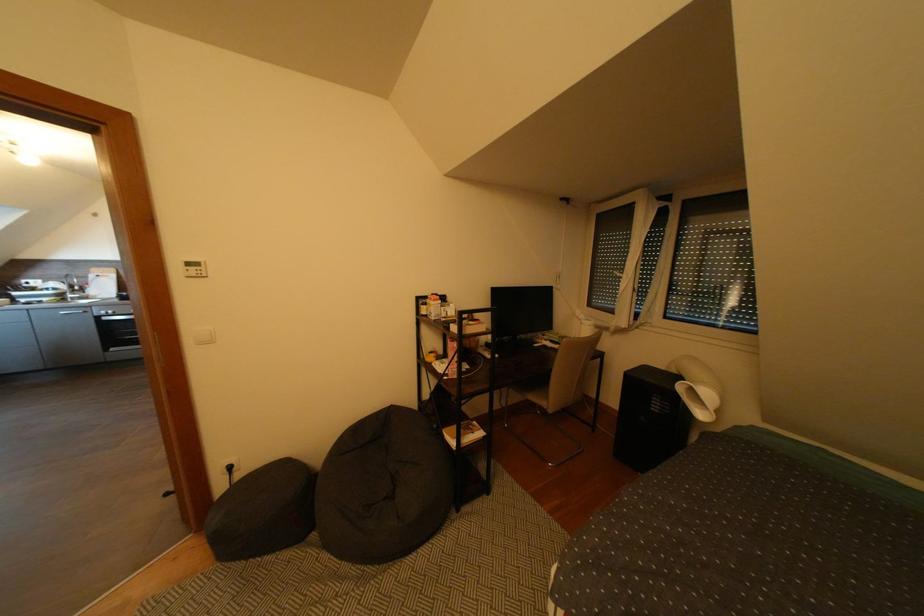
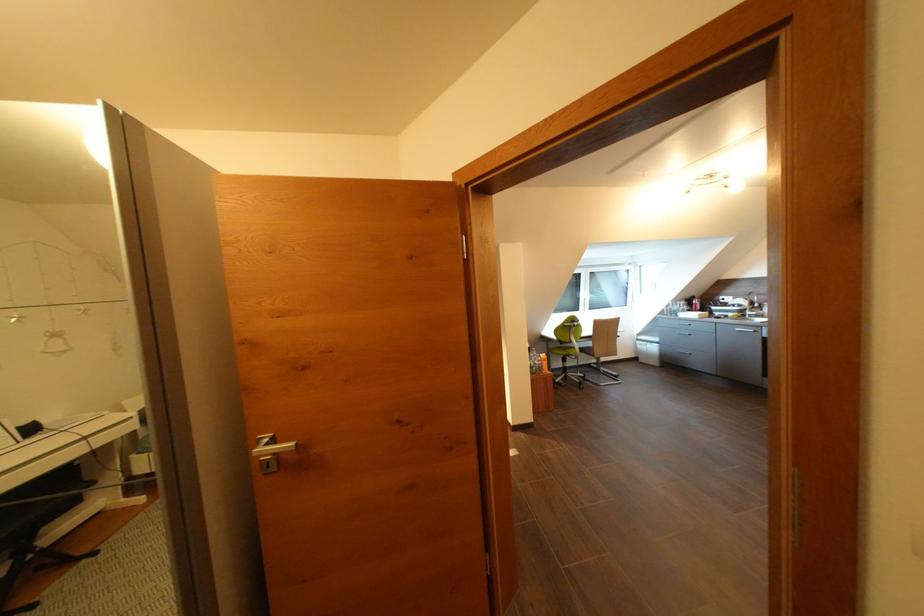
Question: The camera is either moving clockwise (left) or counter-clockwise (right) around the object. The first image is from the beginning of the video and the second image is from the end. Is the camera moving left or right when shooting the video?

Choices:
 (A) Left
 (B) Right

Answer: (B)